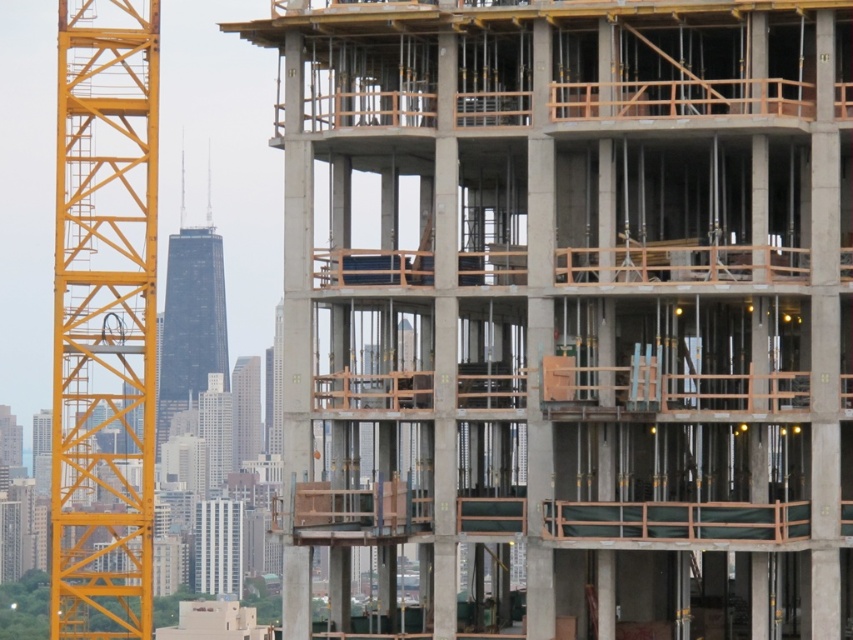
From the picture: What are the coordinates of the dark glass skyscraper at center?

The dark glass skyscraper at center is located at point (190, 323).

You are an inspector standing on the ground floor of the construction site. You need to determine if the yellow metallic crane at left can reach the top of the concrete building at center. Based on their heights, can the crane reach the building top?

The yellow metallic crane at left is much taller than the concrete building at center, so the crane can easily reach the top of the concrete building at center.